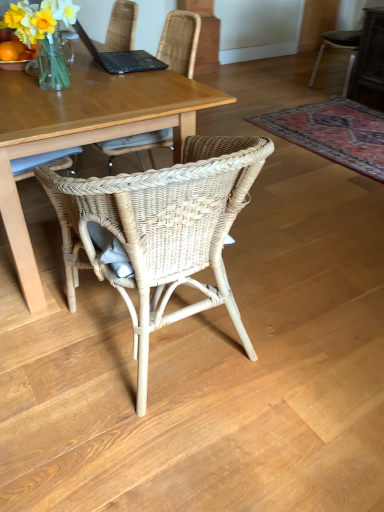
Question: Is translucent glass vase at upper left oriented away from matte wooden desk at center?

Choices:
 (A) yes
 (B) no

Answer: (B)

Question: Does translucent glass vase at upper left have a larger size compared to matte wooden desk at center?

Choices:
 (A) no
 (B) yes

Answer: (A)

Question: Does translucent glass vase at upper left have a greater height compared to matte wooden desk at center?

Choices:
 (A) yes
 (B) no

Answer: (B)

Question: Does translucent glass vase at upper left have a lesser height compared to matte wooden desk at center?

Choices:
 (A) yes
 (B) no

Answer: (A)

Question: Does translucent glass vase at upper left have a smaller size compared to matte wooden desk at center?

Choices:
 (A) no
 (B) yes

Answer: (B)

Question: Is translucent glass vase at upper left at the left side of matte wooden desk at center?

Choices:
 (A) no
 (B) yes

Answer: (A)

Question: From the image's perspective, is matte wooden desk at center located above carpet with intricate pattern at lower right?

Choices:
 (A) yes
 (B) no

Answer: (B)

Question: Are matte wooden desk at center and carpet with intricate pattern at lower right beside each other?

Choices:
 (A) no
 (B) yes

Answer: (A)

Question: From a real-world perspective, is matte wooden desk at center under carpet with intricate pattern at lower right?

Choices:
 (A) no
 (B) yes

Answer: (A)

Question: Is matte wooden desk at center not within carpet with intricate pattern at lower right?

Choices:
 (A) yes
 (B) no

Answer: (A)

Question: Can you confirm if matte wooden desk at center is thinner than carpet with intricate pattern at lower right?

Choices:
 (A) yes
 (B) no

Answer: (A)

Question: From a real-world perspective, is matte wooden desk at center physically above carpet with intricate pattern at lower right?

Choices:
 (A) no
 (B) yes

Answer: (B)

Question: From the image's perspective, is translucent glass vase at upper left beneath dark gray fabric chair at upper right, acting as the first chair starting from the back?

Choices:
 (A) no
 (B) yes

Answer: (B)